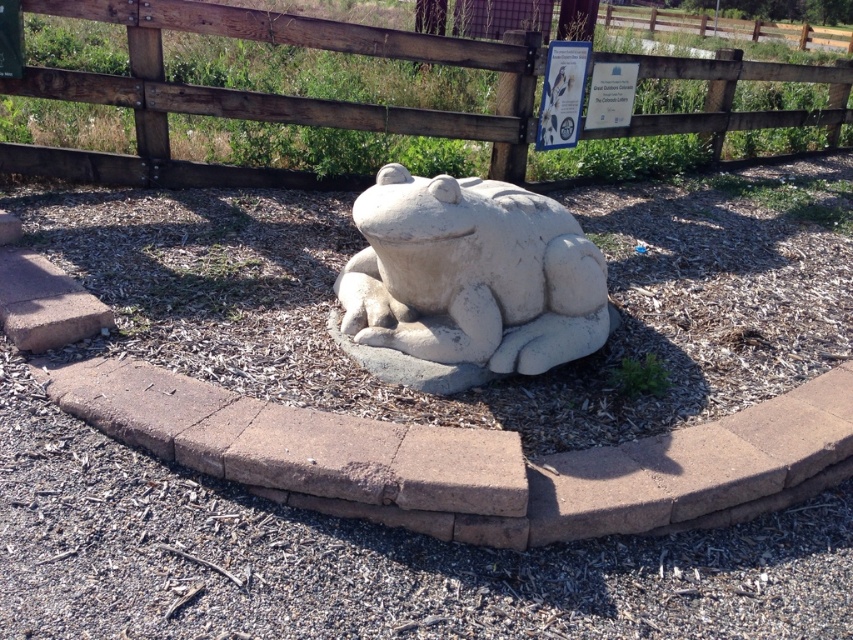
Question: Observing the image, what is the correct spatial positioning of wooden fence at upper center in reference to white stone frog at center?

Choices:
 (A) below
 (B) above

Answer: (B)

Question: Does wooden fence at upper center come behind white stone frog at center?

Choices:
 (A) yes
 (B) no

Answer: (A)

Question: Which of the following is the farthest from the observer?

Choices:
 (A) click(x=515, y=227)
 (B) click(x=294, y=32)

Answer: (B)

Question: Is wooden fence at upper center smaller than white stone frog at center?

Choices:
 (A) no
 (B) yes

Answer: (B)